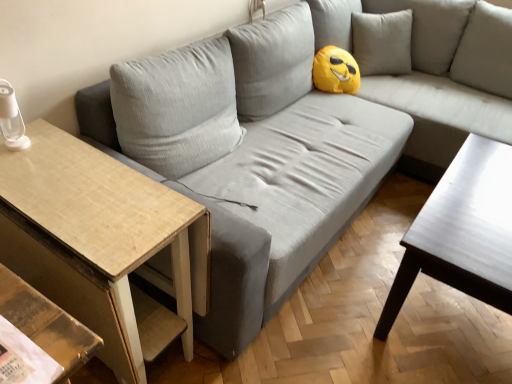
You are a GUI agent. You are given a task and a screenshot of the screen. Output one action in this format:
    pyautogui.click(x=<x>, y=<y>)
    Task: Click on the blank space situated above wooden textured table at left (from a real-world perspective)
    This screenshot has height=384, width=512.
    Given the screenshot: What is the action you would take?
    pyautogui.click(x=70, y=182)